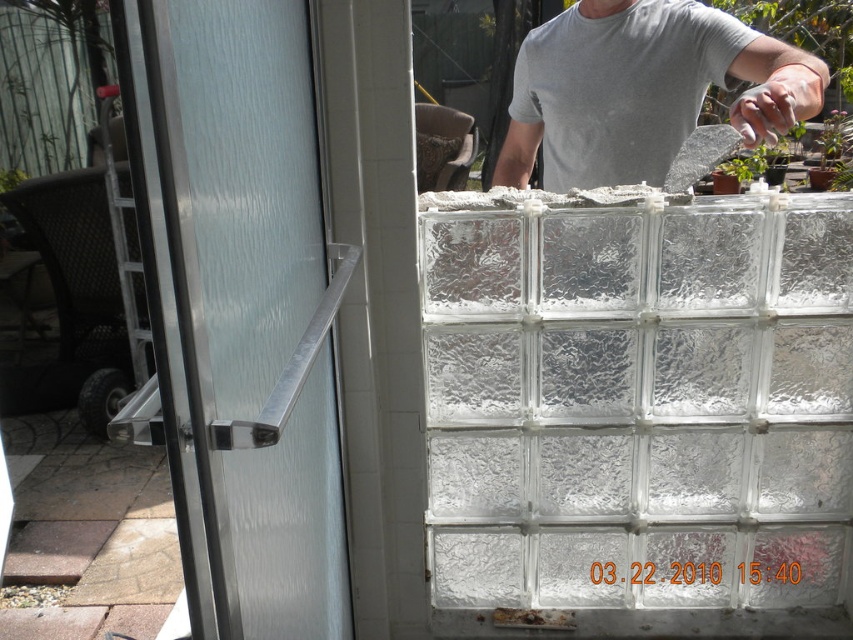
Between frosted glass door handle at left and gray matte shirt at upper center, which one is positioned lower?

frosted glass door handle at left is lower down.

Is point (310, 516) more distant than point (612, 74)?

That is False.

Identify the location of frosted glass door handle at left. The image size is (853, 640). click(x=252, y=307).